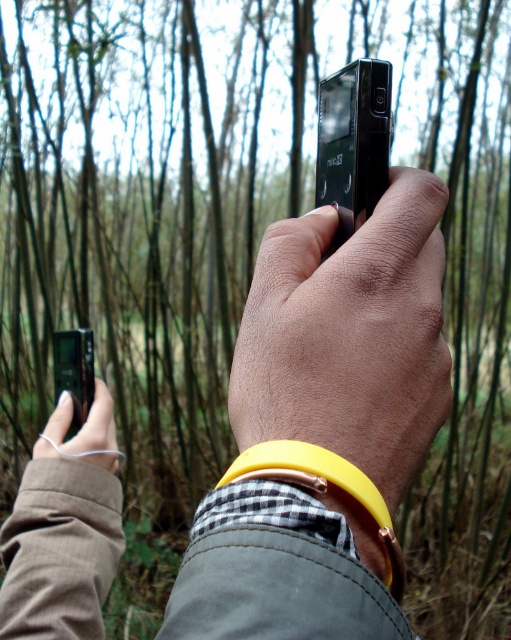
You are a photographer trying to frame a shot of the black glossy smartphone at center in the bamboo forest. Given the dense trees in the background, what adjustment might you make to ensure the smartphone remains the focal point?

Since the black glossy smartphone at center is positioned at point [354,141], you can adjust the camera focus to that coordinate to keep the smartphone in sharp focus while the background trees blur slightly.

You are a photographer trying to capture a clear shot of the bamboo forest. You notice two items in your frame at the center of the image. Which item is closer to the camera between the yellow rubber band at center and the black glossy smartphone at center?

The yellow rubber band at center is closer to the camera because it is in front of the black glossy smartphone at center.